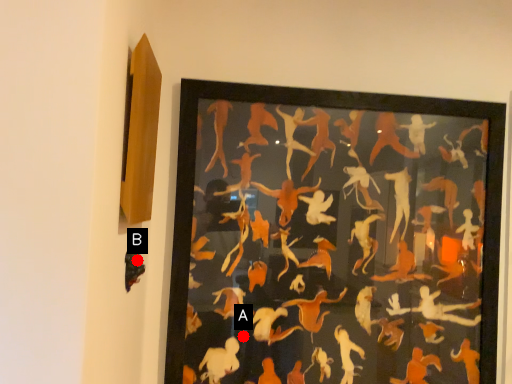
Question: Two points are circled on the image, labeled by A and B beside each circle. Which point is closer to the camera taking this photo?

Choices:
 (A) A is closer
 (B) B is closer

Answer: (B)